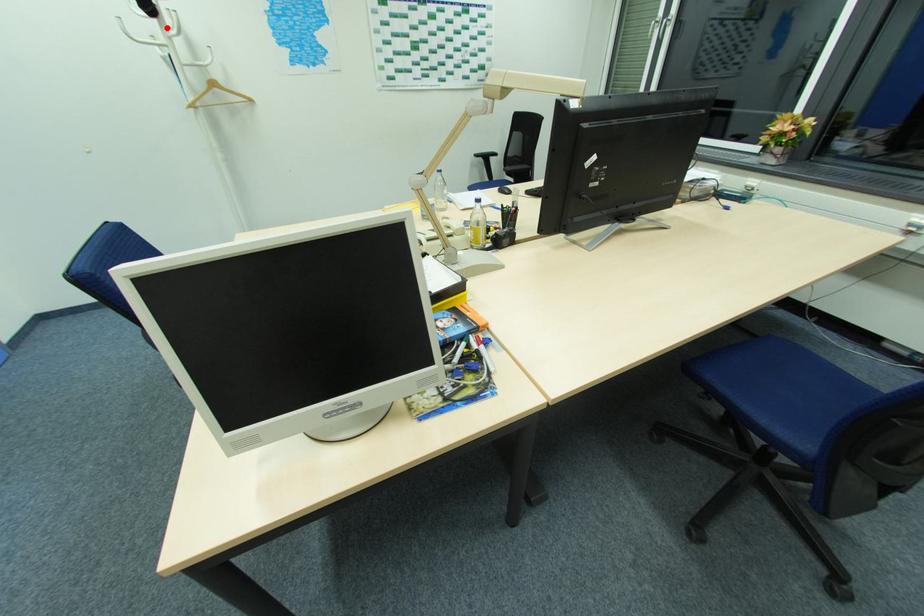
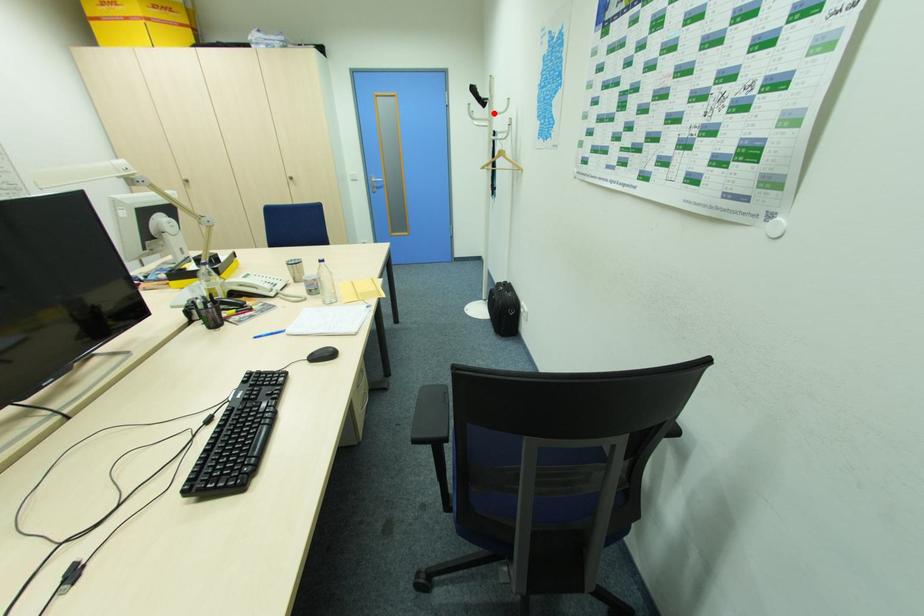
I am providing you with two images of the same scene from different viewpoints. A red point is marked on the first image and another point is marked on the second image. Is the marked point in image1 the same physical position as the marked point in image2?

Yes